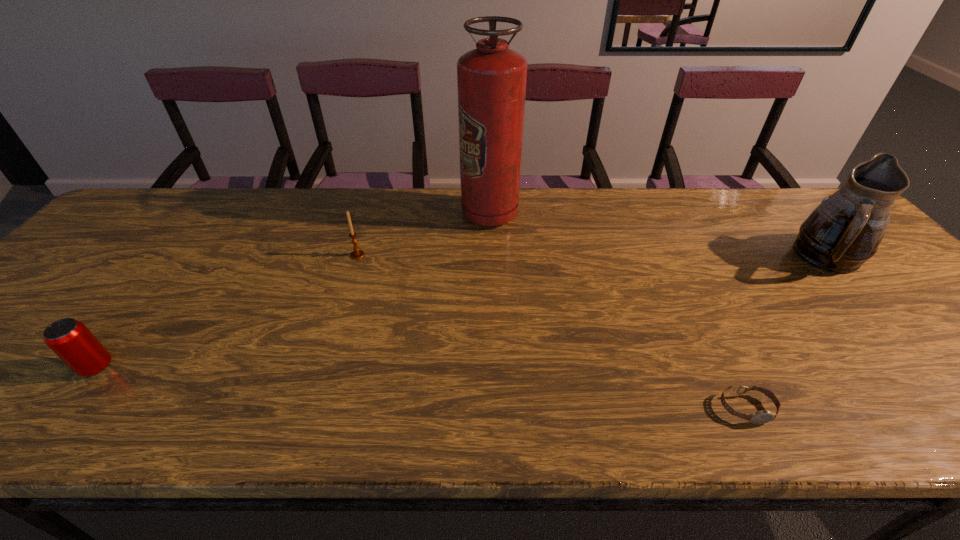
You are a GUI agent. You are given a task and a screenshot of the screen. Output one action in this format:
    pyautogui.click(x=<x>, y=<y>)
    Task: Click on the tallest object
    Image resolution: width=960 pixels, height=540 pixels.
    Given the screenshot: What is the action you would take?
    pyautogui.click(x=491, y=80)

You are a GUI agent. You are given a task and a screenshot of the screen. Output one action in this format:
    pyautogui.click(x=<x>, y=<y>)
    Task: Click on the farthest object
    
    Given the screenshot: What is the action you would take?
    pyautogui.click(x=491, y=80)

Locate an element on the screen. The height and width of the screenshot is (540, 960). pitcher is located at coordinates (844, 231).

The width and height of the screenshot is (960, 540). I want to click on the second tallest object, so click(844, 231).

The image size is (960, 540). I want to click on candle_holder, so click(357, 254).

Identify the location of the leftmost object. (69, 339).

I want to click on the second nearest object, so tap(69, 339).

This screenshot has width=960, height=540. I want to click on the second object from right to left, so click(x=764, y=416).

Where is `watch`? watch is located at coordinates (764, 416).

At what (x,y) coordinates should I click in order to perform the action: click on free space located 0.300m on the label side of the tallest object. Please return your answer as a coordinate pair (x, y). This screenshot has height=540, width=960. Looking at the image, I should click on (362, 214).